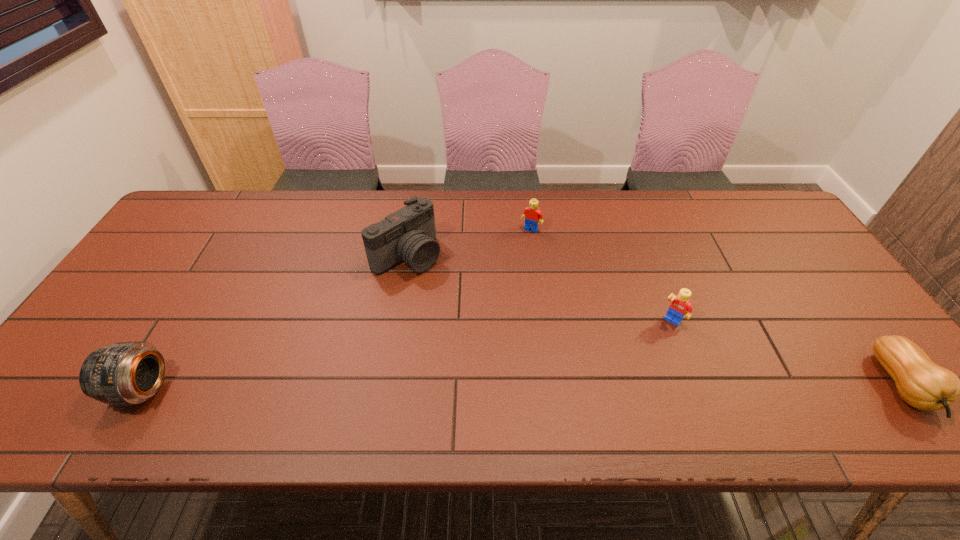
Where is `blank area located at the front element of the telephoto lens`? blank area located at the front element of the telephoto lens is located at coordinates (91, 389).

Where is `blank area located 0.050m on the face of the right Lego`? The height and width of the screenshot is (540, 960). blank area located 0.050m on the face of the right Lego is located at coordinates (656, 339).

You are a GUI agent. You are given a task and a screenshot of the screen. Output one action in this format:
    pyautogui.click(x=<x>, y=<y>)
    Task: Click on the free location located on the face of the right Lego
    The height and width of the screenshot is (540, 960).
    Given the screenshot: What is the action you would take?
    pyautogui.click(x=620, y=393)

In order to click on vacant area located 0.220m on the face of the right Lego in this screenshot , I will do `click(624, 387)`.

I want to click on free space located 0.070m at the lens of the fourth object from right to left, so click(x=446, y=285).

Identify the location of vacant space located at the lens of the fourth object from right to left. This screenshot has height=540, width=960. (454, 291).

The height and width of the screenshot is (540, 960). I want to click on free space located 0.130m at the lens of the fourth object from right to left, so coord(462,297).

The width and height of the screenshot is (960, 540). Find the location of `vacant space located on the face of the third object from right to left`. vacant space located on the face of the third object from right to left is located at coordinates (468, 325).

This screenshot has width=960, height=540. I want to click on free space located on the face of the third object from right to left, so click(x=500, y=274).

Locate an element on the screen. free space located on the face of the third object from right to left is located at coordinates (515, 253).